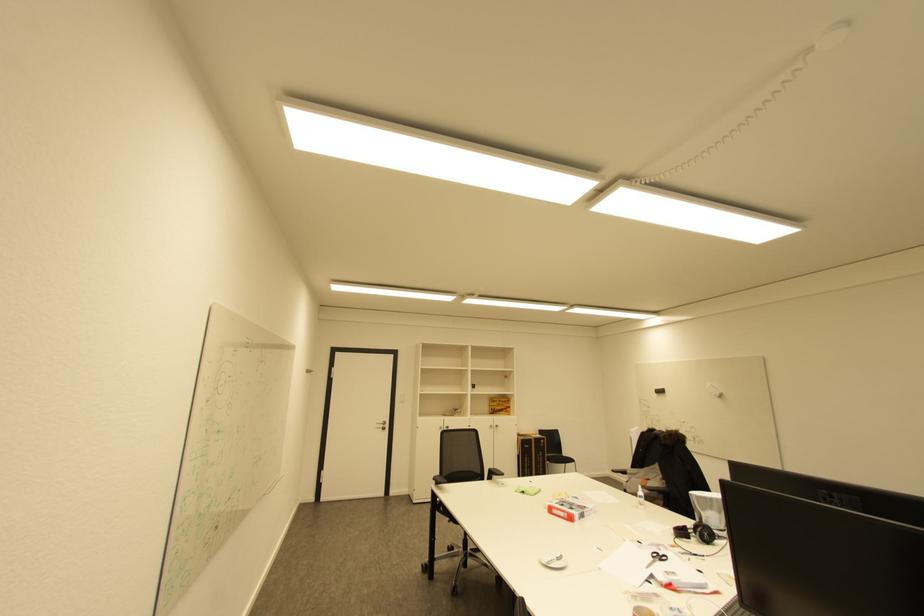
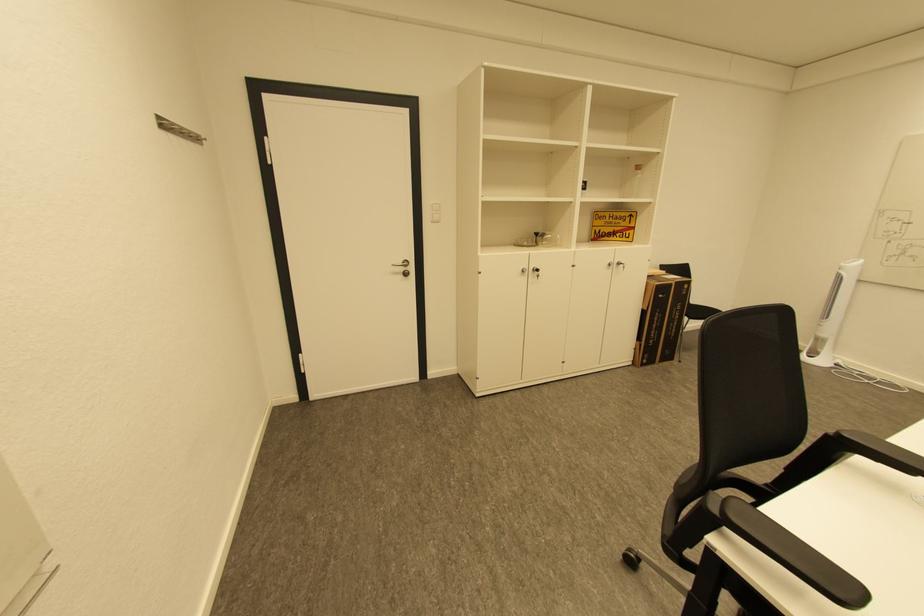
Where in the second image is the point corresponding to (x=388, y=427) from the first image?

(408, 270)